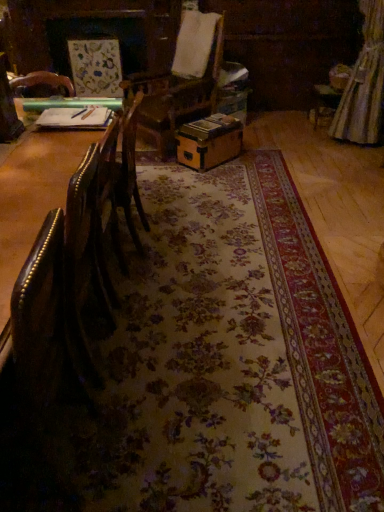
Question: Is leather couch at left completely or partially outside of wooden box at center?

Choices:
 (A) yes
 (B) no

Answer: (A)

Question: Is leather couch at left turned away from wooden box at center?

Choices:
 (A) no
 (B) yes

Answer: (A)

Question: From the image's perspective, does leather couch at left appear lower than wooden box at center?

Choices:
 (A) no
 (B) yes

Answer: (B)

Question: Would you say leather couch at left is a long distance from wooden box at center?

Choices:
 (A) no
 (B) yes

Answer: (B)

Question: From a real-world perspective, is leather couch at left under wooden box at center?

Choices:
 (A) yes
 (B) no

Answer: (B)

Question: Does leather couch at left have a lesser height compared to wooden box at center?

Choices:
 (A) no
 (B) yes

Answer: (A)

Question: Does wooden box at center lie in front of silky beige curtain at upper right?

Choices:
 (A) no
 (B) yes

Answer: (B)

Question: From the image's perspective, is wooden box at center under silky beige curtain at upper right?

Choices:
 (A) yes
 (B) no

Answer: (A)

Question: Does wooden box at center appear on the right side of silky beige curtain at upper right?

Choices:
 (A) yes
 (B) no

Answer: (B)

Question: Does wooden box at center appear on the left side of silky beige curtain at upper right?

Choices:
 (A) yes
 (B) no

Answer: (A)

Question: From a real-world perspective, is wooden box at center under silky beige curtain at upper right?

Choices:
 (A) yes
 (B) no

Answer: (A)

Question: Could silky beige curtain at upper right be considered to be inside wooden box at center?

Choices:
 (A) no
 (B) yes

Answer: (A)

Question: Does leather couch at left have a lesser height compared to silky beige curtain at upper right?

Choices:
 (A) no
 (B) yes

Answer: (B)